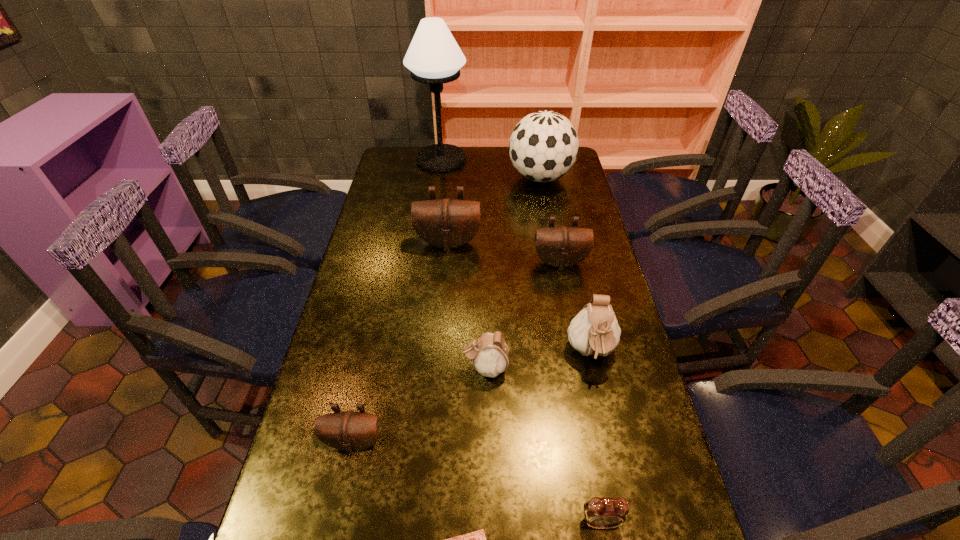
At what (x,y) coordinates should I click in order to perform the action: click on free space at the right edge of the desktop. Please return your answer as a coordinate pair (x, y). This screenshot has height=540, width=960. Looking at the image, I should click on (583, 307).

Image resolution: width=960 pixels, height=540 pixels. In order to click on vacant space at the far left corner in this screenshot , I will do `click(384, 160)`.

You are a GUI agent. You are given a task and a screenshot of the screen. Output one action in this format:
    pyautogui.click(x=<x>, y=<y>)
    Task: Click on the blank area at the far right corner
    
    Given the screenshot: What is the action you would take?
    pyautogui.click(x=571, y=172)

Locate an element on the screen. The width and height of the screenshot is (960, 540). vacant area between the second tallest object and the left white pouch is located at coordinates (513, 273).

Find the location of a particular element. The width and height of the screenshot is (960, 540). free space between the rightmost brown pouch and the biggest brown pouch is located at coordinates (504, 253).

Locate an element on the screen. vacant area that lies between the biggest brown pouch and the alarm clock is located at coordinates (524, 382).

The width and height of the screenshot is (960, 540). In order to click on free area in between the table lamp and the right white pouch in this screenshot , I will do `click(516, 256)`.

Identify the location of vacant point located between the second nearest object and the biggest brown pouch. This screenshot has height=540, width=960. (524, 382).

Image resolution: width=960 pixels, height=540 pixels. Identify the location of vacant area that lies between the second tallest object and the tallest object. [491, 169].

Locate an element on the screen. The image size is (960, 540). empty location between the alarm clock and the smallest brown pouch is located at coordinates (477, 482).